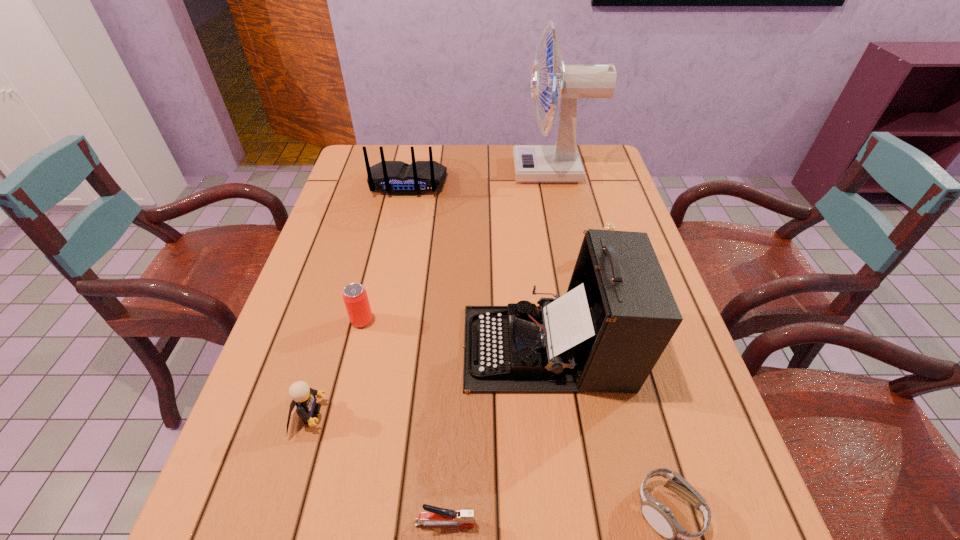
Image resolution: width=960 pixels, height=540 pixels. Find the location of `router present at the far edge`. router present at the far edge is located at coordinates (397, 178).

Locate an element on the screen. object that is positioned at the near edge is located at coordinates (436, 516).

In order to click on router present at the left edge in this screenshot , I will do `click(397, 178)`.

The height and width of the screenshot is (540, 960). I want to click on beer can present at the left edge, so click(x=355, y=297).

Locate an element on the screen. This screenshot has height=540, width=960. Lego located at the left edge is located at coordinates 304,397.

Identify the location of fan that is at the right edge. (560, 163).

Where is `typewriter positioned at the right edge`? This screenshot has height=540, width=960. typewriter positioned at the right edge is located at coordinates (606, 334).

I want to click on Lego at the right edge, so coord(608,226).

This screenshot has height=540, width=960. In order to click on object that is at the far left corner in this screenshot , I will do `click(397, 178)`.

Find the location of a particular element. object present at the far right corner is located at coordinates (560, 163).